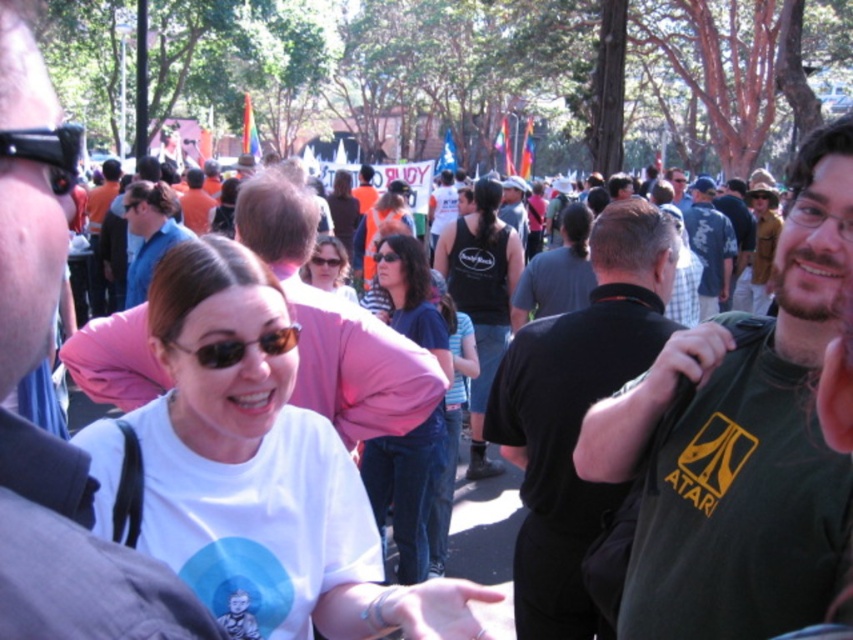
You are a photographer standing at the center of the scene. You want to take a picture of the dark blue jeans at center and the brown leather jacket at upper right. Can you fit both objects in your camera frame if your camera has a 1.5 meter wide field of view?

The dark blue jeans at center is 1.66 meters away from the brown leather jacket at upper right. Since the distance between them exceeds the camera frame width of 1.5 meters, you cannot fit both objects in the frame.

You are at a park and see two people wearing different clothing items. The first person is wearing a black tank top at center, and the second person is wearing a brown leather jacket at upper right. Which clothing item is located lower in the image?

The black tank top at center is positioned under the brown leather jacket at upper right, so the black tank top at center is located lower in the image.